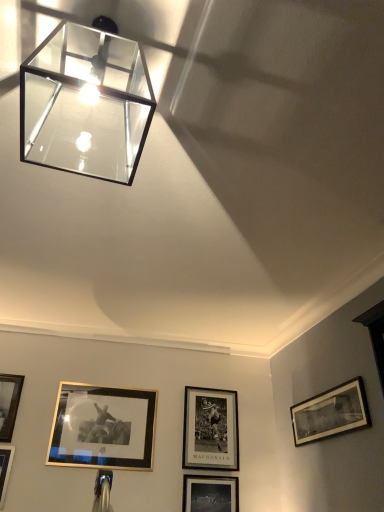
At what (x,y) coordinates should I click in order to perform the action: click on matte black picture frame at lower center, the third picture frame viewed from the right. Please return your answer as a coordinate pair (x, y). Image resolution: width=384 pixels, height=512 pixels. Looking at the image, I should click on (210, 494).

What do you see at coordinates (9, 403) in the screenshot? I see `gold-framed picture at lower left, which is the 5th picture frame from right to left` at bounding box center [9, 403].

This screenshot has width=384, height=512. What do you see at coordinates (85, 103) in the screenshot?
I see `clear glass cube at upper left` at bounding box center [85, 103].

What do you see at coordinates (331, 413) in the screenshot?
I see `black matte picture frame at lower right, the 5th picture frame in the left-to-right sequence` at bounding box center [331, 413].

The height and width of the screenshot is (512, 384). In order to click on gold metallic picture frame at lower left, the 2th picture frame in the left-to-right sequence in this screenshot , I will do `click(103, 428)`.

In terms of size, does gold metallic picture frame at lower left, placed as the 4th picture frame when sorted from right to left, appear bigger or smaller than black matte picture frame at center, positioned as the fourth picture frame in left-to-right order?

Clearly, gold metallic picture frame at lower left, placed as the 4th picture frame when sorted from right to left, is smaller in size than black matte picture frame at center, positioned as the fourth picture frame in left-to-right order.

In the image, is gold metallic picture frame at lower left, the 2th picture frame in the left-to-right sequence, positioned in front of or behind black matte picture frame at center, positioned as the fourth picture frame in left-to-right order?

In the image, gold metallic picture frame at lower left, the 2th picture frame in the left-to-right sequence, appears in front of black matte picture frame at center, positioned as the fourth picture frame in left-to-right order.

Is gold metallic picture frame at lower left, placed as the 4th picture frame when sorted from right to left, not near black matte picture frame at center, placed as the second picture frame when sorted from right to left?

No.

From a real-world perspective, is gold metallic picture frame at lower left, placed as the 4th picture frame when sorted from right to left, below black matte picture frame at center, placed as the second picture frame when sorted from right to left?

Yes, from a real-world perspective, gold metallic picture frame at lower left, placed as the 4th picture frame when sorted from right to left, is beneath black matte picture frame at center, placed as the second picture frame when sorted from right to left.

Based on the photo, which is in front, black matte picture frame at lower right, which is the 1th picture frame from right to left, or matte black picture frame at lower center, the third picture frame viewed from the right?

black matte picture frame at lower right, which is the 1th picture frame from right to left, is more forward.

Looking at this image, is black matte picture frame at lower right, the 5th picture frame in the left-to-right sequence, touching matte black picture frame at lower center, which is counted as the 3th picture frame, starting from the left?

There is a gap between black matte picture frame at lower right, the 5th picture frame in the left-to-right sequence, and matte black picture frame at lower center, which is counted as the 3th picture frame, starting from the left.

Which of these two, black matte picture frame at lower right, the 5th picture frame in the left-to-right sequence, or matte black picture frame at lower center, which is counted as the 3th picture frame, starting from the left, is smaller?

Smaller between the two is matte black picture frame at lower center, which is counted as the 3th picture frame, starting from the left.

Which is behind, point (301, 438) or point (197, 482)?

Positioned behind is point (197, 482).

Is the depth of black matte picture frame at lower right, which is the 1th picture frame from right to left, less than that of gold metallic picture frame at lower left, the 2th picture frame in the left-to-right sequence?

Yes, it is in front of gold metallic picture frame at lower left, the 2th picture frame in the left-to-right sequence.

Consider the image. From the image's perspective, would you say black matte picture frame at lower right, the 5th picture frame in the left-to-right sequence, is positioned over gold metallic picture frame at lower left, the 2th picture frame in the left-to-right sequence?

Yes, from the image's perspective, black matte picture frame at lower right, the 5th picture frame in the left-to-right sequence, is over gold metallic picture frame at lower left, the 2th picture frame in the left-to-right sequence.

From a real-world perspective, is black matte picture frame at lower right, which is the 1th picture frame from right to left, above or below gold metallic picture frame at lower left, placed as the 4th picture frame when sorted from right to left?

In terms of real-world spatial position, black matte picture frame at lower right, which is the 1th picture frame from right to left, is above gold metallic picture frame at lower left, placed as the 4th picture frame when sorted from right to left.

Where is `picture frame above the gold-framed picture at lower left, placed as the first picture frame when sorted from left to right (from the image's perspective)`? This screenshot has height=512, width=384. picture frame above the gold-framed picture at lower left, placed as the first picture frame when sorted from left to right (from the image's perspective) is located at coordinates (331, 413).

Is the surface of gold-framed picture at lower left, which is the 5th picture frame from right to left, in direct contact with black matte picture frame at lower right, the 5th picture frame in the left-to-right sequence?

They are not placed beside each other.

From a real-world perspective, between gold-framed picture at lower left, which is the 5th picture frame from right to left, and black matte picture frame at lower right, the 5th picture frame in the left-to-right sequence, who is vertically lower?

black matte picture frame at lower right, the 5th picture frame in the left-to-right sequence.

Is gold-framed picture at lower left, placed as the first picture frame when sorted from left to right, at the left side of black matte picture frame at lower right, which is the 1th picture frame from right to left?

Correct, you'll find gold-framed picture at lower left, placed as the first picture frame when sorted from left to right, to the left of black matte picture frame at lower right, which is the 1th picture frame from right to left.

From a real-world perspective, is gold metallic picture frame at lower left, placed as the 4th picture frame when sorted from right to left, physically below black matte picture frame at lower right, the 5th picture frame in the left-to-right sequence?

Correct, in the physical world, gold metallic picture frame at lower left, placed as the 4th picture frame when sorted from right to left, is lower than black matte picture frame at lower right, the 5th picture frame in the left-to-right sequence.

You are a GUI agent. You are given a task and a screenshot of the screen. Output one action in this format:
    pyautogui.click(x=<x>, y=<y>)
    Task: Click on the 1st picture frame located beneath the black matte picture frame at lower right, the 5th picture frame in the left-to-right sequence (from a real-world perspective)
    This screenshot has height=512, width=384.
    Given the screenshot: What is the action you would take?
    pyautogui.click(x=103, y=428)

Are gold metallic picture frame at lower left, the 2th picture frame in the left-to-right sequence, and black matte picture frame at lower right, the 5th picture frame in the left-to-right sequence, beside each other?

No.

Which is in front, point (209, 410) or point (23, 379)?

The point (23, 379) is more forward.

Are black matte picture frame at center, positioned as the fourth picture frame in left-to-right order, and gold-framed picture at lower left, placed as the first picture frame when sorted from left to right, far apart?

black matte picture frame at center, positioned as the fourth picture frame in left-to-right order, is far away from gold-framed picture at lower left, placed as the first picture frame when sorted from left to right.

Can you tell me how much black matte picture frame at center, placed as the second picture frame when sorted from right to left, and gold-framed picture at lower left, placed as the first picture frame when sorted from left to right, differ in facing direction?

The angular difference between black matte picture frame at center, placed as the second picture frame when sorted from right to left, and gold-framed picture at lower left, placed as the first picture frame when sorted from left to right, is 0.00504 degrees.

Which of these two, black matte picture frame at center, placed as the second picture frame when sorted from right to left, or gold-framed picture at lower left, placed as the first picture frame when sorted from left to right, is smaller?

With smaller size is gold-framed picture at lower left, placed as the first picture frame when sorted from left to right.

Between black matte picture frame at center, placed as the second picture frame when sorted from right to left, and gold metallic picture frame at lower left, placed as the 4th picture frame when sorted from right to left, which one has smaller size?

With smaller size is gold metallic picture frame at lower left, placed as the 4th picture frame when sorted from right to left.

Is black matte picture frame at center, placed as the second picture frame when sorted from right to left, turned away from gold metallic picture frame at lower left, the 2th picture frame in the left-to-right sequence?

No, black matte picture frame at center, placed as the second picture frame when sorted from right to left, is not facing the opposite direction of gold metallic picture frame at lower left, the 2th picture frame in the left-to-right sequence.

Is black matte picture frame at center, placed as the second picture frame when sorted from right to left, shorter than gold metallic picture frame at lower left, placed as the 4th picture frame when sorted from right to left?

In fact, black matte picture frame at center, placed as the second picture frame when sorted from right to left, may be taller than gold metallic picture frame at lower left, placed as the 4th picture frame when sorted from right to left.

From a real-world perspective, who is located lower, black matte picture frame at center, positioned as the fourth picture frame in left-to-right order, or gold metallic picture frame at lower left, placed as the 4th picture frame when sorted from right to left?

gold metallic picture frame at lower left, placed as the 4th picture frame when sorted from right to left, from a real-world perspective.

Where is `the 2nd picture frame counting from the right side of the gold metallic picture frame at lower left, the 2th picture frame in the left-to-right sequence`? The width and height of the screenshot is (384, 512). the 2nd picture frame counting from the right side of the gold metallic picture frame at lower left, the 2th picture frame in the left-to-right sequence is located at coordinates (210, 429).

From the image's perspective, which picture frame is the 4th one above the matte black picture frame at lower center, the third picture frame viewed from the right? Please provide its 2D coordinates.

[(331, 413)]

Which object lies nearer to the anchor point black matte picture frame at lower right, the 5th picture frame in the left-to-right sequence, clear glass cube at upper left or black matte picture frame at center, placed as the second picture frame when sorted from right to left?

black matte picture frame at center, placed as the second picture frame when sorted from right to left.

From the image, which object appears to be farther from gold-framed picture at lower left, which is the 5th picture frame from right to left, black matte picture frame at lower right, the 5th picture frame in the left-to-right sequence, or clear glass cube at upper left?

Based on the image, clear glass cube at upper left appears to be further to gold-framed picture at lower left, which is the 5th picture frame from right to left.

Looking at the image, which one is located closer to black matte picture frame at lower right, which is the 1th picture frame from right to left, matte black picture frame at lower center, which is counted as the 3th picture frame, starting from the left, or gold metallic picture frame at lower left, placed as the 4th picture frame when sorted from right to left?

Result: matte black picture frame at lower center, which is counted as the 3th picture frame, starting from the left, lies closer to black matte picture frame at lower right, which is the 1th picture frame from right to left, than the other object.

From the picture: Based on their spatial positions, is gold metallic picture frame at lower left, placed as the 4th picture frame when sorted from right to left, or gold-framed picture at lower left, which is the 5th picture frame from right to left, closer to clear glass cube at upper left?

gold metallic picture frame at lower left, placed as the 4th picture frame when sorted from right to left, is positioned closer to the anchor clear glass cube at upper left.

Which object lies nearer to the anchor point black matte picture frame at lower right, the 5th picture frame in the left-to-right sequence, gold-framed picture at lower left, which is the 5th picture frame from right to left, or matte black picture frame at lower center, which is counted as the 3th picture frame, starting from the left?

matte black picture frame at lower center, which is counted as the 3th picture frame, starting from the left, is closer to black matte picture frame at lower right, the 5th picture frame in the left-to-right sequence.

When comparing their distances from matte black picture frame at lower center, which is counted as the 3th picture frame, starting from the left, does clear glass cube at upper left or gold metallic picture frame at lower left, placed as the 4th picture frame when sorted from right to left, seem further?

Among the two, clear glass cube at upper left is located further to matte black picture frame at lower center, which is counted as the 3th picture frame, starting from the left.

Looking at the image, which one is located closer to clear glass cube at upper left, black matte picture frame at lower right, the 5th picture frame in the left-to-right sequence, or black matte picture frame at center, positioned as the fourth picture frame in left-to-right order?

Based on the image, black matte picture frame at lower right, the 5th picture frame in the left-to-right sequence, appears to be nearer to clear glass cube at upper left.

Estimate the real-world distances between objects in this image. Which object is further from black matte picture frame at center, placed as the second picture frame when sorted from right to left, clear glass cube at upper left or gold metallic picture frame at lower left, placed as the 4th picture frame when sorted from right to left?

clear glass cube at upper left is positioned further to the anchor black matte picture frame at center, placed as the second picture frame when sorted from right to left.

Identify the location of lamp between gold-framed picture at lower left, which is the 5th picture frame from right to left, and black matte picture frame at lower right, which is the 1th picture frame from right to left. This screenshot has width=384, height=512. (85, 103).

At what (x,y) coordinates should I click in order to perform the action: click on picture frame between gold-framed picture at lower left, placed as the first picture frame when sorted from left to right, and matte black picture frame at lower center, the third picture frame viewed from the right, in the horizontal direction. Please return your answer as a coordinate pair (x, y). The image size is (384, 512). Looking at the image, I should click on (103, 428).

The image size is (384, 512). In order to click on picture frame situated between matte black picture frame at lower center, which is counted as the 3th picture frame, starting from the left, and black matte picture frame at lower right, which is the 1th picture frame from right to left, from left to right in this screenshot , I will do `click(210, 429)`.

Where is `picture frame between gold metallic picture frame at lower left, placed as the 4th picture frame when sorted from right to left, and black matte picture frame at center, positioned as the fourth picture frame in left-to-right order, from left to right`? picture frame between gold metallic picture frame at lower left, placed as the 4th picture frame when sorted from right to left, and black matte picture frame at center, positioned as the fourth picture frame in left-to-right order, from left to right is located at coordinates (210, 494).